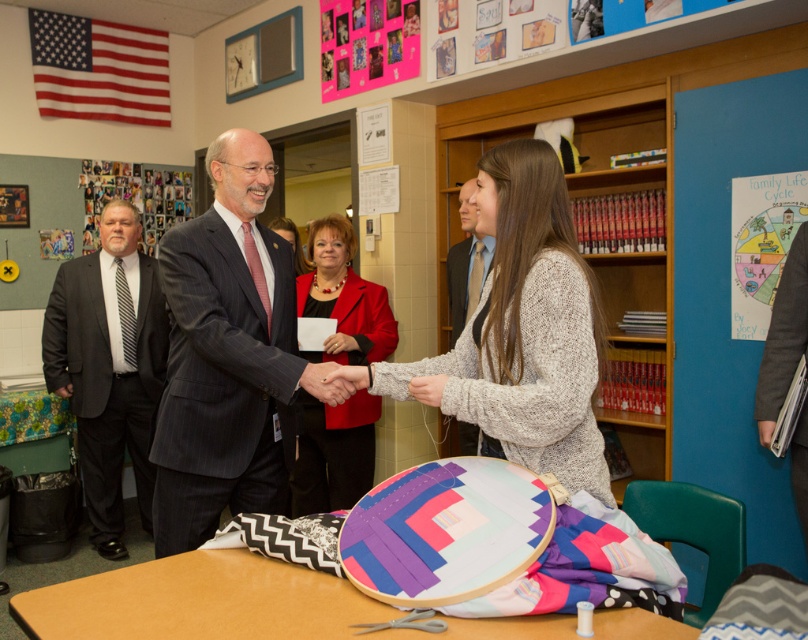
Can you confirm if dark gray pinstripe suit at center is positioned to the left of matte red blazer at center?

Correct, you'll find dark gray pinstripe suit at center to the left of matte red blazer at center.

Which of these two, dark gray pinstripe suit at center or matte red blazer at center, stands taller?

With more height is matte red blazer at center.

Which is behind, point (245, 376) or point (351, 499)?

Point (351, 499)

Where is `dark gray pinstripe suit at center`? This screenshot has height=640, width=808. dark gray pinstripe suit at center is located at coordinates (228, 356).

What do you see at coordinates (108, 365) in the screenshot?
I see `black striped tie at left` at bounding box center [108, 365].

Consider the image. Can you confirm if black striped tie at left is bigger than smooth gray suit at center?

Indeed, black striped tie at left has a larger size compared to smooth gray suit at center.

This screenshot has width=808, height=640. Describe the element at coordinates (108, 365) in the screenshot. I see `black striped tie at left` at that location.

The width and height of the screenshot is (808, 640). Find the location of `black striped tie at left`. black striped tie at left is located at coordinates (108, 365).

Find the location of `knitted sweater at center`. knitted sweater at center is located at coordinates (524, 330).

The width and height of the screenshot is (808, 640). In order to click on knitted sweater at center in this screenshot , I will do `click(524, 330)`.